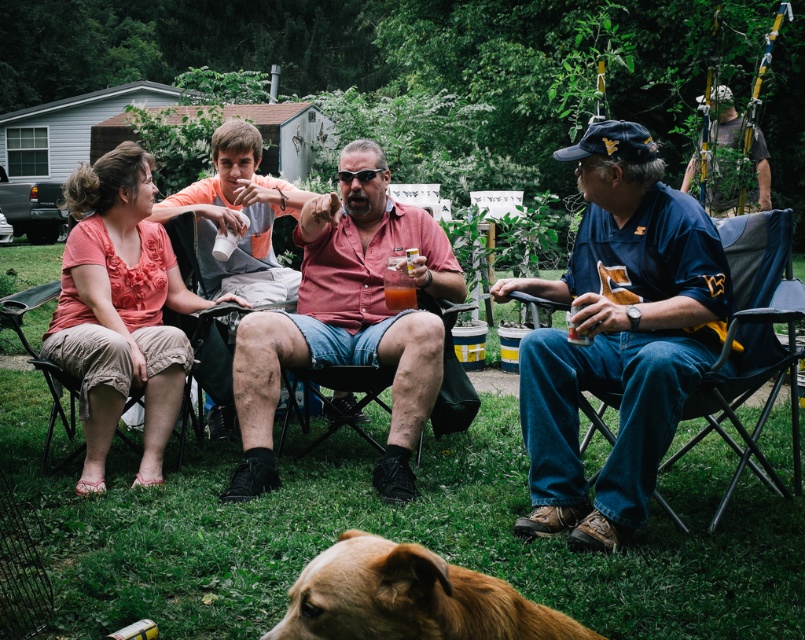
In the scene shown: Is blue denim shirt at right smaller than camouflage fabric hat at upper right?

Yes, blue denim shirt at right is smaller than camouflage fabric hat at upper right.

Who is lower down, blue denim shirt at right or camouflage fabric hat at upper right?

blue denim shirt at right

Find the location of a particular element. blue denim shirt at right is located at coordinates (617, 337).

Does point (614, 195) come behind point (401, 588)?

Yes, it is behind point (401, 588).

Can you confirm if blue denim shirt at right is positioned to the left of brown furry dog at lower center?

In fact, blue denim shirt at right is to the right of brown furry dog at lower center.

Between point (638, 396) and point (308, 608), which one is positioned behind?

Point (638, 396)

At what (x,y) coordinates should I click in order to perform the action: click on blue denim shirt at right. Please return your answer as a coordinate pair (x, y). Looking at the image, I should click on (617, 337).

Does denim fabric chair at right appear on the left side of translucent plastic cup at center?

No, denim fabric chair at right is not to the left of translucent plastic cup at center.

Based on the photo, who is more forward, (721, 403) or (391, 301)?

Point (721, 403) is more forward.

Is point (779, 346) less distant than point (386, 305)?

That is True.

Where is `denim fabric chair at right`? This screenshot has height=640, width=805. denim fabric chair at right is located at coordinates (749, 337).